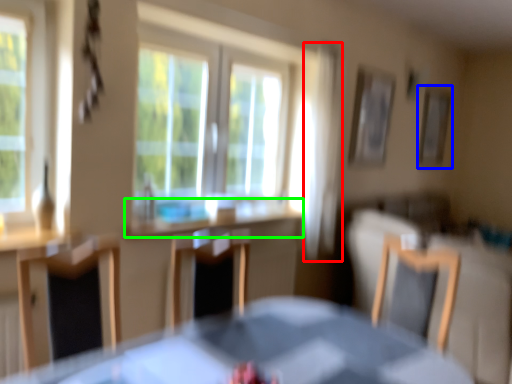
Question: Based on their relative distances, which object is nearer to curtain (highlighted by a red box)? Choose from picture frame (highlighted by a blue box) and counter top (highlighted by a green box).

Choices:
 (A) picture frame
 (B) counter top

Answer: (B)